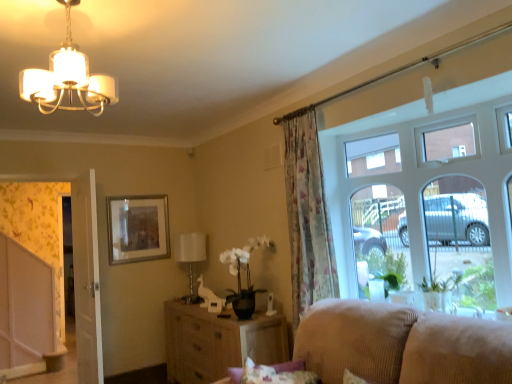
Question: Is floral fabric curtain at center spatially inside beige corduroy couch at lower right, or outside of it?

Choices:
 (A) inside
 (B) outside

Answer: (B)

Question: Is floral fabric curtain at center taller or shorter than beige corduroy couch at lower right?

Choices:
 (A) short
 (B) tall

Answer: (B)

Question: Which object is the farthest from the woven wood cabinet at center?

Choices:
 (A) floral fabric curtain at center
 (B) silver metallic picture frame at upper center
 (C) beige corduroy couch at lower right
 (D) white glossy screen door at left
 (E) white wooden door at left

Answer: (D)

Question: Which object is positioned closest to the white wooden door at left?

Choices:
 (A) beige corduroy couch at lower right
 (B) silver metallic picture frame at upper center
 (C) clear glass window at right
 (D) woven wood cabinet at center
 (E) white glossy screen door at left

Answer: (B)